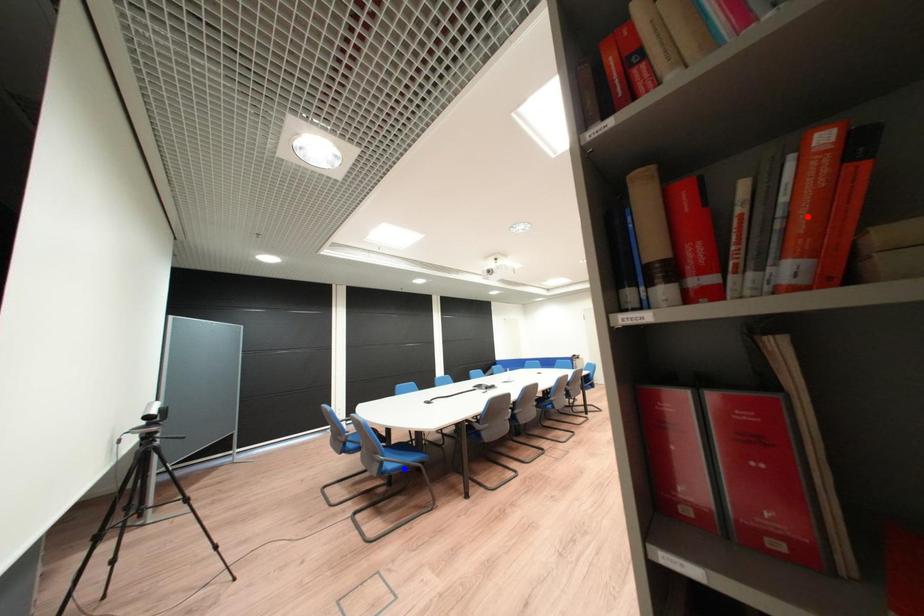
Question: Which of the two points in the image is closer to the camera?

Choices:
 (A) Blue point is closer.
 (B) Red point is closer.

Answer: (B)